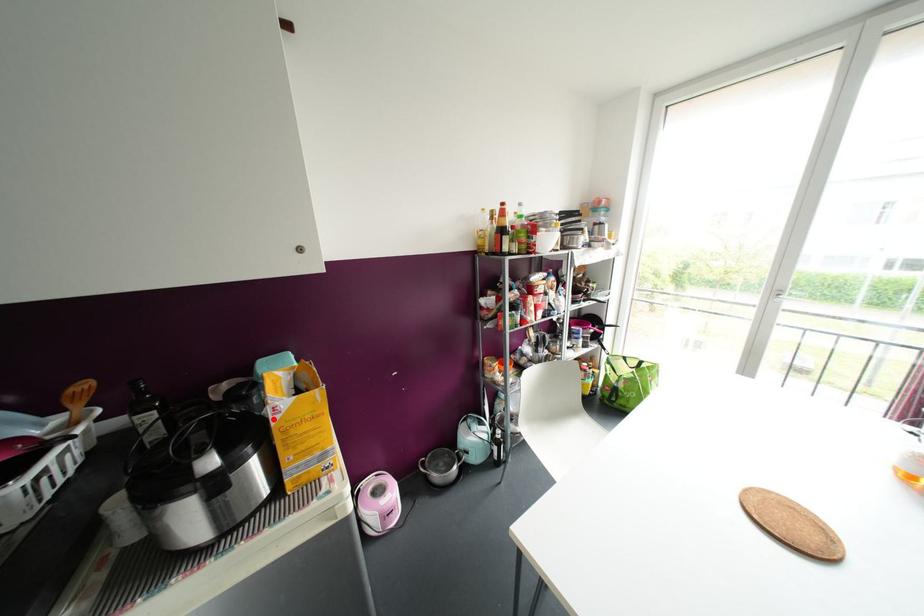
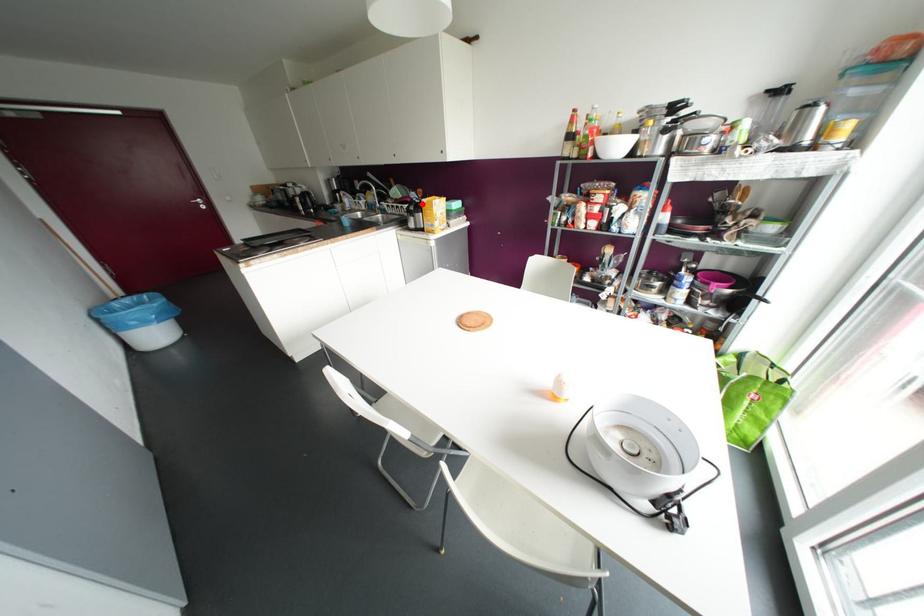
I am providing you with two images of the same scene from different viewpoints. A red point is marked on the first image and another point is marked on the second image. Do the highlighted points in image1 and image2 indicate the same real-world spot?

Yes